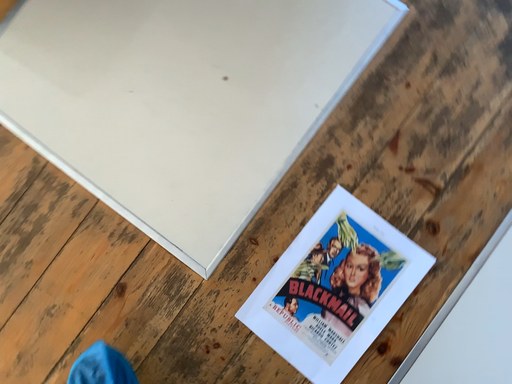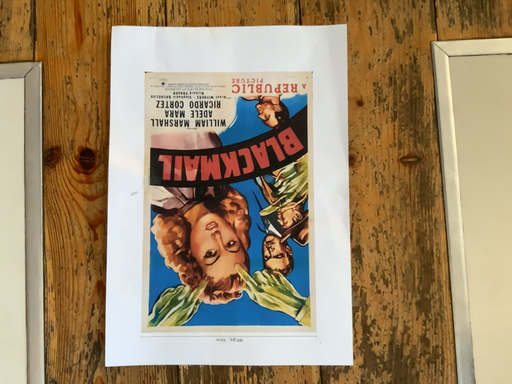
Question: Which way did the camera rotate in the video?

Choices:
 (A) rotated right
 (B) rotated left

Answer: (B)